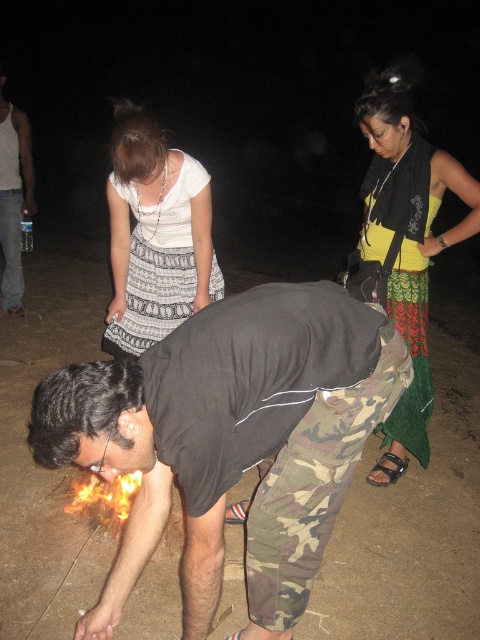
Question: Is yellow-green printed skirt at center smaller than white tank top at left?

Choices:
 (A) yes
 (B) no

Answer: (B)

Question: Can you confirm if camouflage pants at center is positioned to the right of white tank top at left?

Choices:
 (A) yes
 (B) no

Answer: (A)

Question: Which of these objects is positioned closest to the camouflage pants at center?

Choices:
 (A) yellow-green printed skirt at center
 (B) flaming wood at lower left
 (C) white tank top at left
 (D) black matte shirt at center

Answer: (B)

Question: Considering the real-world distances, which object is closest to the yellow-green printed skirt at center?

Choices:
 (A) camouflage pants at center
 (B) flaming wood at lower left
 (C) white tank top at left

Answer: (A)

Question: Can you confirm if yellow-green printed skirt at center is thinner than flaming wood at lower left?

Choices:
 (A) yes
 (B) no

Answer: (B)

Question: Based on their relative distances, which object is farther from the camouflage pants at center?

Choices:
 (A) white tank top at left
 (B) black matte shirt at center
 (C) yellow-green printed skirt at center
 (D) flaming wood at lower left

Answer: (A)